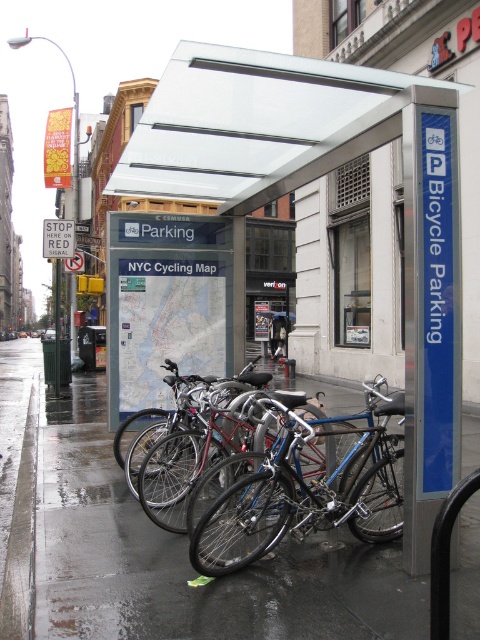
How distant is transparent plastic canopy at upper center from shiny blue bike at center?

transparent plastic canopy at upper center and shiny blue bike at center are 8.98 feet apart.

Who is more forward, [254,170] or [264,467]?

Point [264,467]

Which is behind, point (187, 186) or point (348, 490)?

Positioned behind is point (187, 186).

At what (x,y) coordinates should I click in order to perform the action: click on transparent plastic canopy at upper center. Please return your answer as a coordinate pair (x, y). The width and height of the screenshot is (480, 640). Looking at the image, I should click on (261, 124).

Can you confirm if wet asphalt at lower center is positioned to the left of metallic bicycle at center?

Correct, you'll find wet asphalt at lower center to the left of metallic bicycle at center.

Who is more distant from viewer, (x=38, y=624) or (x=286, y=314)?

The point (x=286, y=314) is more distant.

What are the coordinates of `wet asphalt at lower center` in the screenshot? It's located at (188, 560).

Who is taller, shiny blue bike at center or metallic bicycle at center?

metallic bicycle at center is taller.

Is point (235, 532) more distant than point (275, 349)?

No, it is in front of (275, 349).

Find the location of `shiny blue bike at center`. shiny blue bike at center is located at coordinates point(301,500).